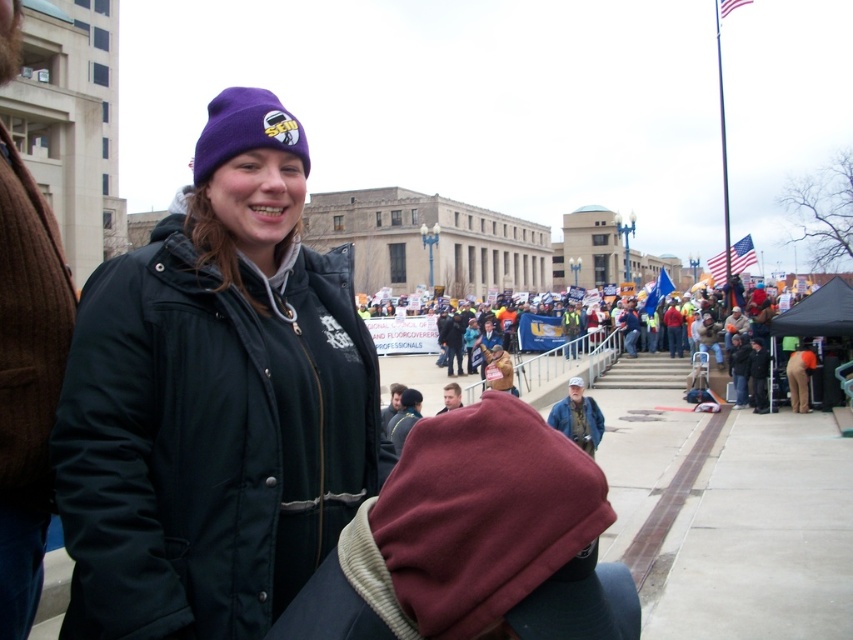
You are a photographer trying to capture a clear shot of the yellow reflective vests at center. However, the purple fleece beanie at upper center is blocking your view. Can you adjust your position to avoid the obstruction?

The purple fleece beanie at upper center is in front of the yellow reflective vests at center, so moving your camera position slightly backward or to the side could help avoid the obstruction and capture the yellow reflective vests at center clearly.

You are standing at point A located at coordinates point A at (364, 364). You want to walk to point B which is 52.41 feet away. Is this distance within a typical walking distance for a person?

Yes, 52.41 feet is a typical walking distance for a person.

You are a photographer standing at the camera position. You want to take a closeup shot of the purple fleece beanie at upper center. The camera has a maximum zoom range of 12 meters. Can you capture the beanie in focus without moving closer?

The purple fleece beanie at upper center is 14.52 meters from camera, which exceeds the camera maximum zoom range of 12 meters. Therefore, the photographer cannot capture the beanie in focus without moving closer.